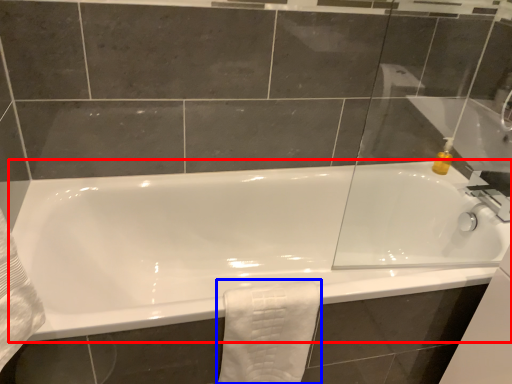
Question: Which point is further to the camera, bathtub (highlighted by a red box) or bath towel (highlighted by a blue box)?

Choices:
 (A) bathtub
 (B) bath towel

Answer: (B)